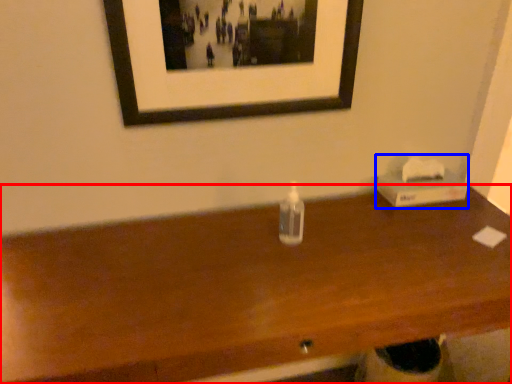
Question: Which object appears farthest to the camera in this image, table (highlighted by a red box) or box (highlighted by a blue box)?

Choices:
 (A) table
 (B) box

Answer: (B)